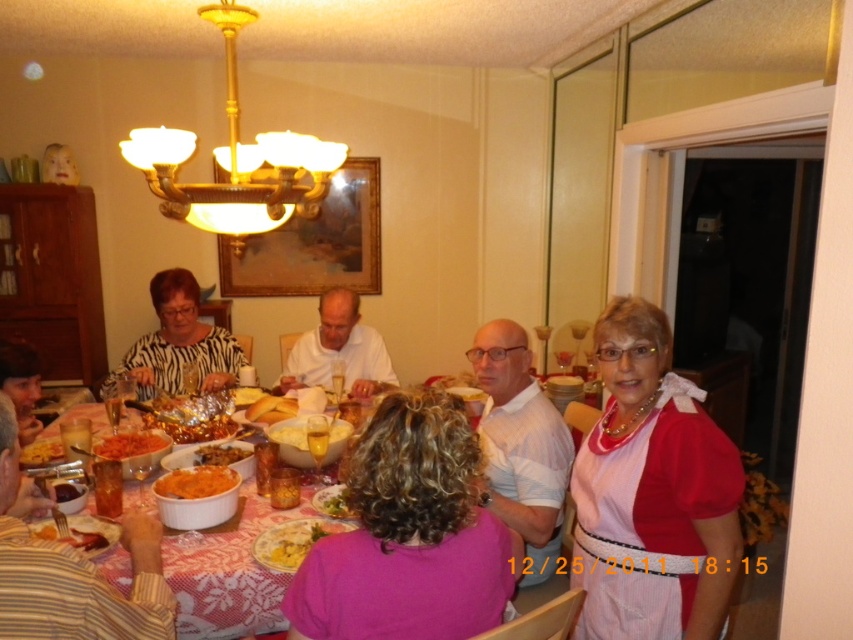
You are a guest at the dinner table and want to choose a dish that is larger in size between the orange mashed potato at center and the green leafy vegetable at center. Which one should you pick?

The orange mashed potato at center is bigger than the green leafy vegetable at center, so you should pick the orange mashed potato at center.